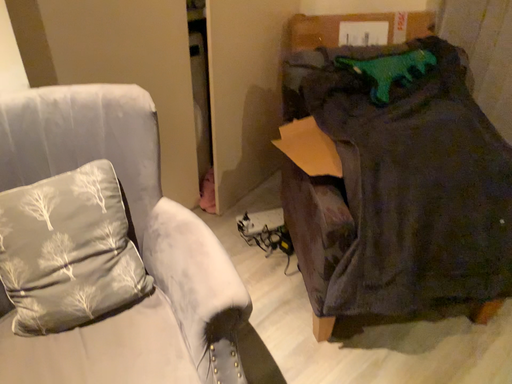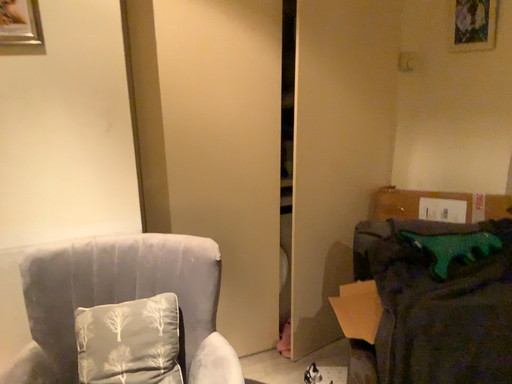
Question: Which way did the camera rotate in the video?

Choices:
 (A) rotated upward
 (B) rotated downward

Answer: (A)